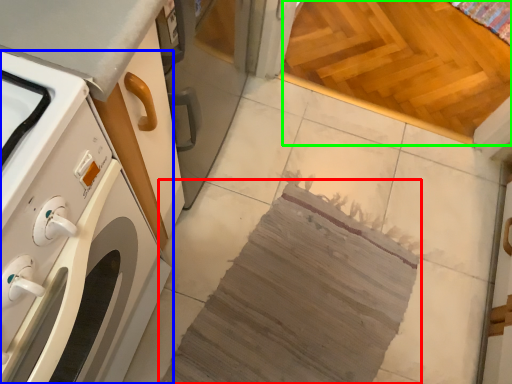
Question: Based on their relative distances, which object is nearer to blanket (highlighted by a red box)? Choose from home appliance (highlighted by a blue box) and plywood (highlighted by a green box).

Choices:
 (A) home appliance
 (B) plywood

Answer: (A)